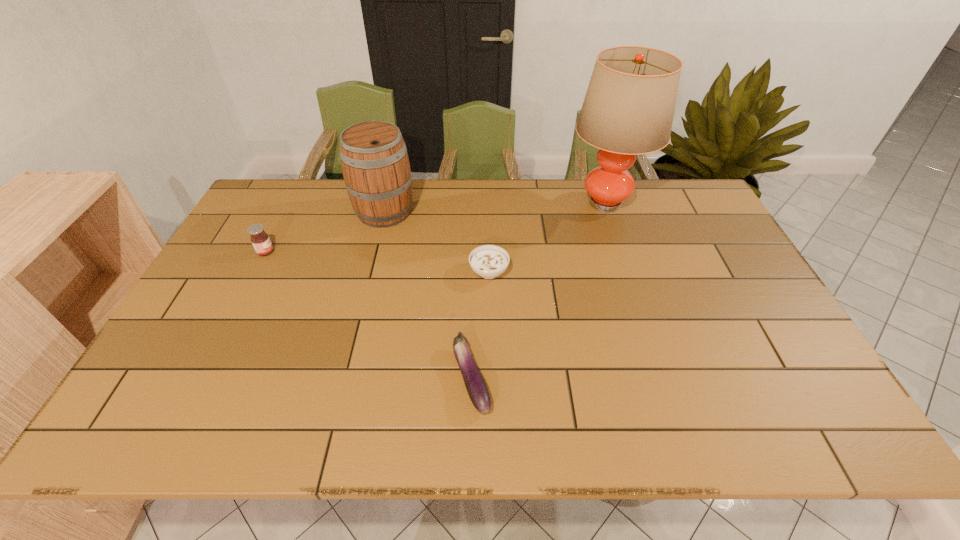
I want to click on the tallest object, so click(x=628, y=110).

Locate an element on the screen. Image resolution: width=960 pixels, height=540 pixels. lamp is located at coordinates (628, 110).

Image resolution: width=960 pixels, height=540 pixels. I want to click on the second object from left to right, so click(375, 164).

This screenshot has width=960, height=540. What are the coordinates of `the fourth shortest object` in the screenshot? It's located at (375, 164).

At what (x,y) coordinates should I click in order to perform the action: click on jam. Please return your answer as a coordinate pair (x, y). Looking at the image, I should click on (260, 240).

The image size is (960, 540). Identify the location of the third shortest object. (260, 240).

The image size is (960, 540). What are the coordinates of `soup bowl` in the screenshot? It's located at (488, 261).

The height and width of the screenshot is (540, 960). In order to click on eggplant in this screenshot , I will do `click(475, 384)`.

At what (x,y) coordinates should I click in order to perform the action: click on blank space located on the front of the rightmost object. Please return your answer as a coordinate pair (x, y). Looking at the image, I should click on (620, 246).

This screenshot has height=540, width=960. I want to click on vacant area situated on the right of the second tallest object, so click(x=532, y=212).